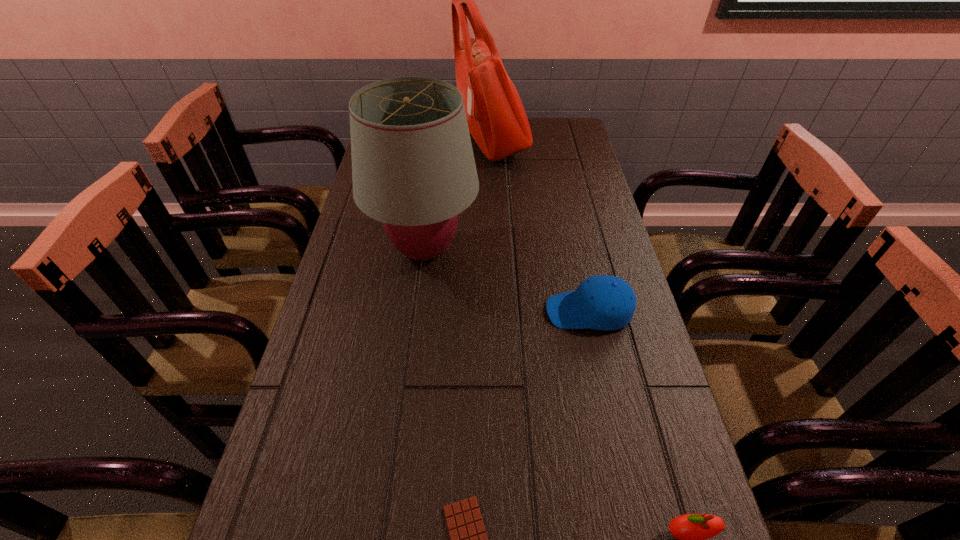
Where is `object present at the far edge`? object present at the far edge is located at coordinates click(497, 121).

The width and height of the screenshot is (960, 540). I want to click on object situated at the left edge, so click(413, 169).

You are a GUI agent. You are given a task and a screenshot of the screen. Output one action in this format:
    pyautogui.click(x=<x>, y=<y>)
    Task: Click on the object that is positioned at the right edge
    Image resolution: width=960 pixels, height=540 pixels.
    Given the screenshot: What is the action you would take?
    pyautogui.click(x=603, y=302)

In the image, there is a desktop. Where is `vacant space at the far edge`? The width and height of the screenshot is (960, 540). vacant space at the far edge is located at coordinates (536, 130).

This screenshot has height=540, width=960. I want to click on free space at the left edge, so click(x=355, y=472).

I want to click on vacant space at the right edge of the desktop, so click(585, 230).

You are a GUI agent. You are given a task and a screenshot of the screen. Output one action in this format:
    pyautogui.click(x=<x>, y=<y>)
    Task: Click on the vacant space at the far right corner
    The width and height of the screenshot is (960, 540).
    Given the screenshot: What is the action you would take?
    pyautogui.click(x=553, y=124)

Locate an element on the screen. The image size is (960, 540). vacant area that lies between the fourth nearest object and the third nearest object is located at coordinates (507, 281).

Identify which object is located as the third nearest to the apple. Please provide its 2D coordinates. Your answer should be formatted as a tuple, i.e. [(x, y)], where the tuple contains the x and y coordinates of a point satisfying the conditions above.

[(413, 169)]

Locate an element on the screen. This screenshot has width=960, height=540. the closest object relative to the second farthest object is located at coordinates (603, 302).